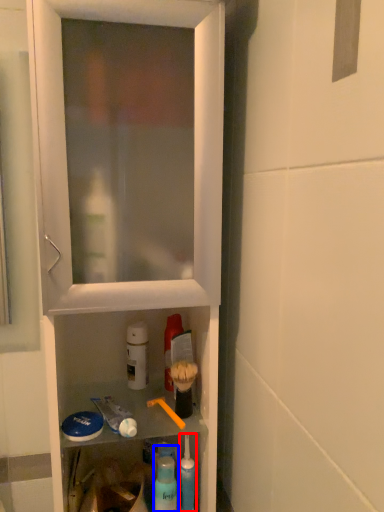
Question: Which of the following is the farthest to the observer, toiletry (highlighted by a red box) or cleaning product (highlighted by a blue box)?

Choices:
 (A) toiletry
 (B) cleaning product

Answer: (A)